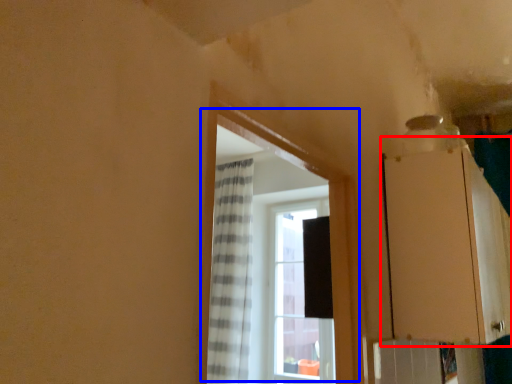
Question: Which of the following is the closest to the observer, cabinetry (highlighted by a red box) or window (highlighted by a blue box)?

Choices:
 (A) cabinetry
 (B) window

Answer: (B)